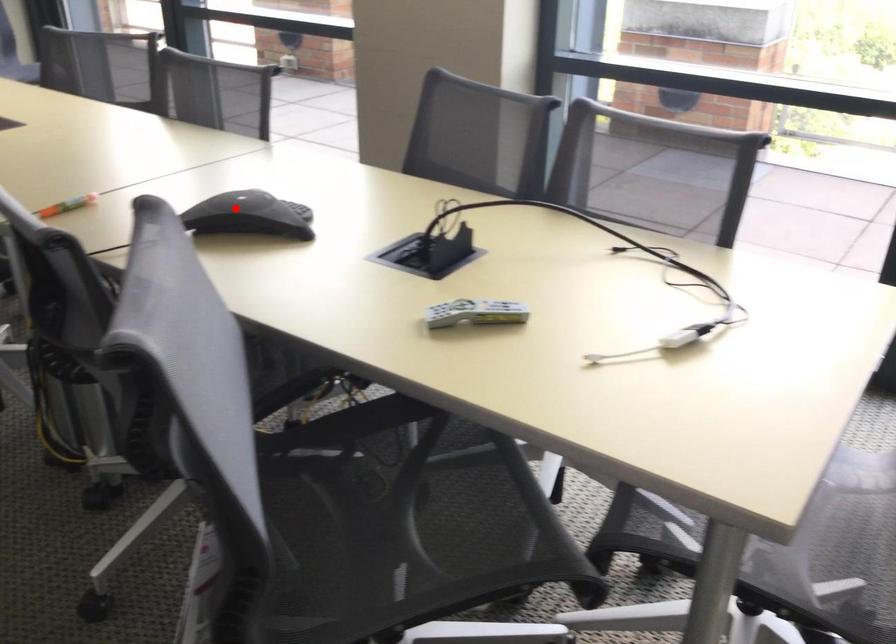
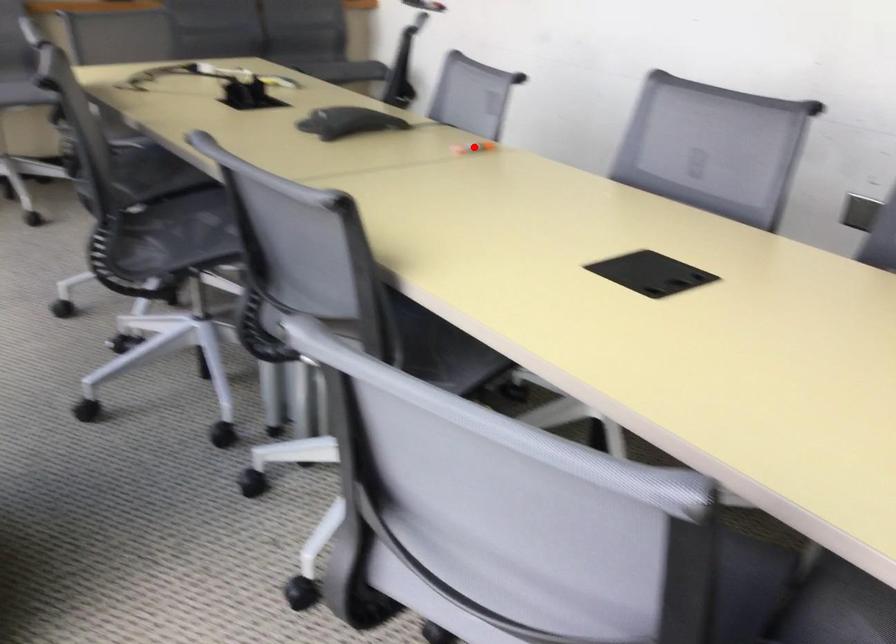
I am providing you with two images of the same scene from different viewpoints. A red point is marked on the first image and another point is marked on the second image. Is the red point in image1 aligned with the point shown in image2?

No